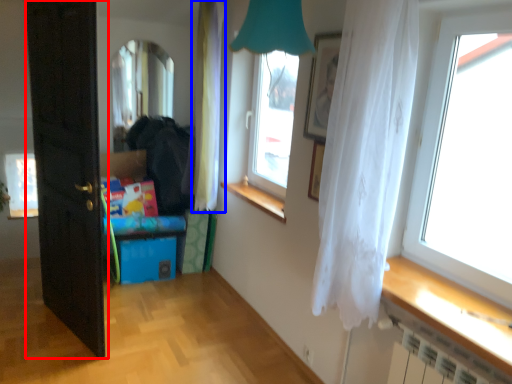
Question: Which of the following is the farthest to the observer, door (highlighted by a red box) or curtain (highlighted by a blue box)?

Choices:
 (A) door
 (B) curtain

Answer: (B)